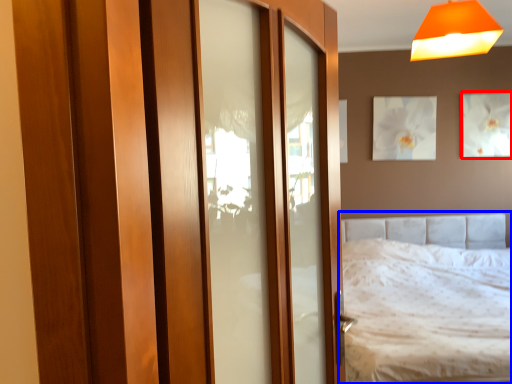
Question: Which of the following is the closest to the observer, picture frame (highlighted by a red box) or bed (highlighted by a blue box)?

Choices:
 (A) picture frame
 (B) bed

Answer: (B)